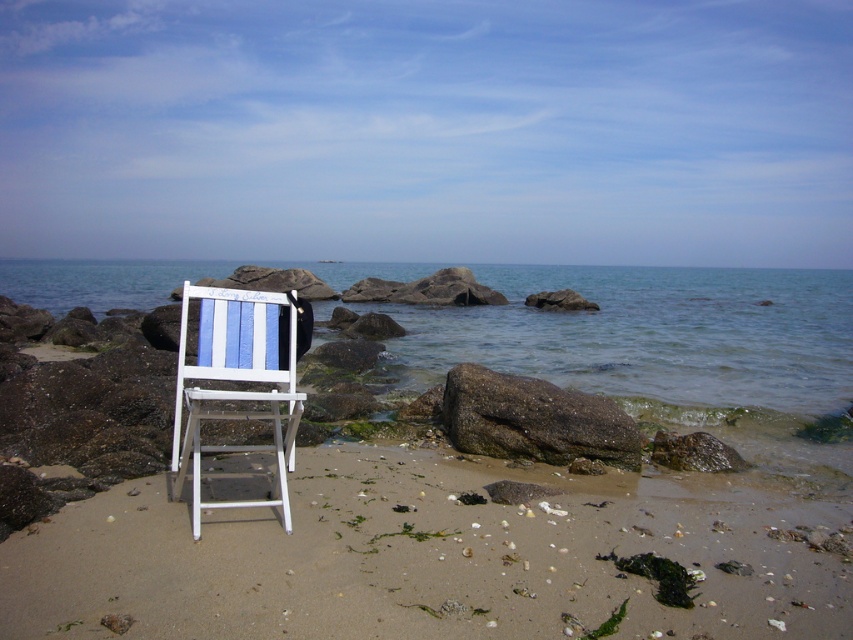
You are a beachgoer who wants to place a small umbrella next to the white wood chair at center. Based on the scene description, where should you place the umbrella to avoid the sandy brown at lower center?

The sandy brown at lower center is positioned under the white wood chair at center, so you should place the umbrella to the side or behind the white wood chair at center to avoid the sandy brown at lower center.

You are standing at the edge of the beach and want to place a small bucket exactly where the sandy brown at lower center is located. According to the coordinates provided, where should you place the bucket?

You should place the bucket at the coordinates point [421,560] where the sandy brown at lower center is located.